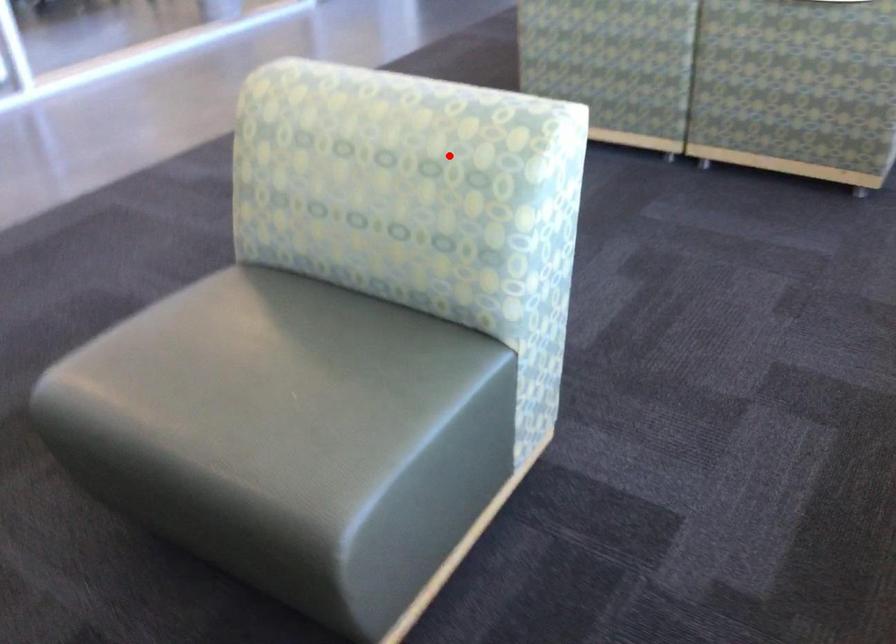
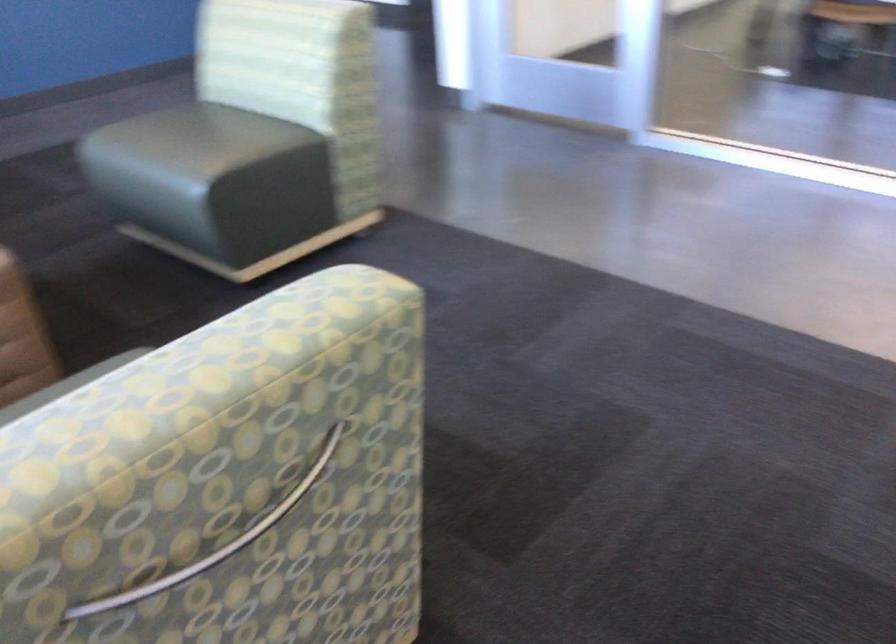
The point at the highlighted location is marked in the first image. Where is the corresponding point in the second image?

(216, 542)